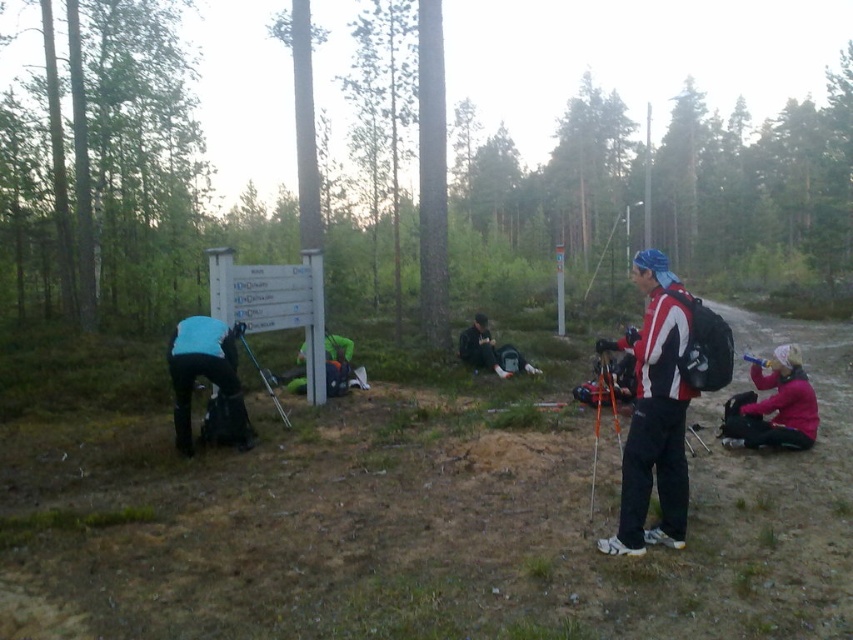
You are a hiker trying to follow the trail signs. You notice two people ahead of you on the path. One is wearing a red and white ski jacket at right and another in a dark blue jacket at center. Which person is closer to the signpost?

The red and white ski jacket at right is in front of the dark blue jacket at center, so the person in the red and white ski jacket at right is closer to the signpost.

You are a hiker trying to decide which item to carry first. The blue fabric skier at left and the metallic silver ski pole at lower center are both in your path. Which item is narrower so you can pick it up more easily?

The blue fabric skier at left is thinner than the metallic silver ski pole at lower center, so it is narrower and easier to pick up.

You are a hiker trying to determine the best path to continue your journey. You notice two landmarks near the signpost. The first is a blue fabric skier at left and the second is a dark blue jacket at center. Which landmark is taller?

The blue fabric skier at left is taller than the dark blue jacket at center.